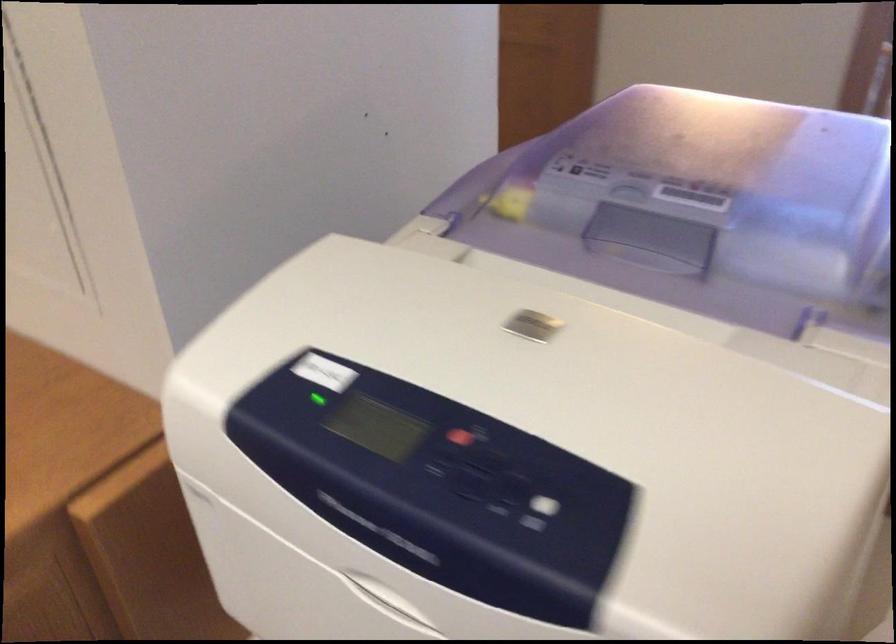
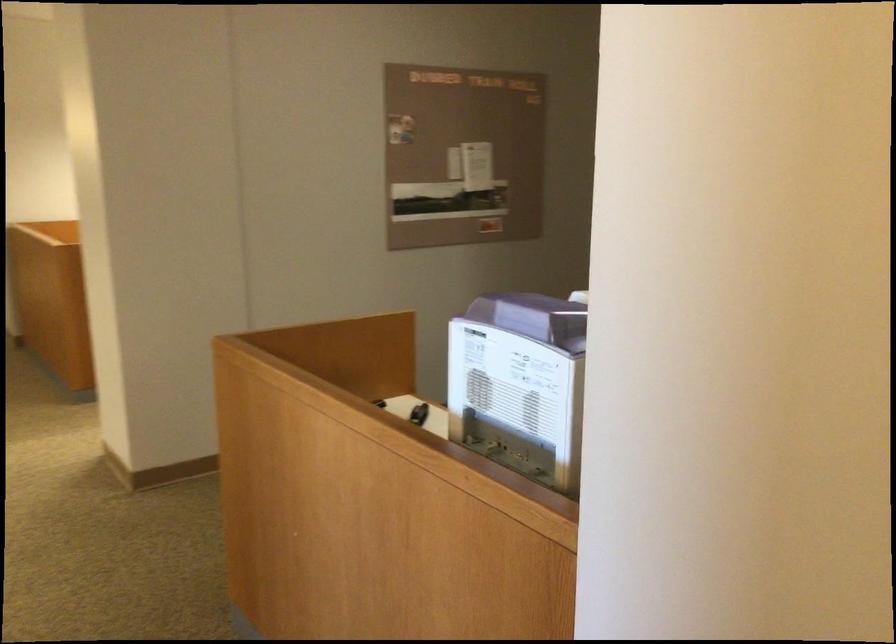
Question: I am providing you with two images of the same scene from different viewpoints. Which of the following objects are not visible in image2?

Choices:
 (A) small black object
 (B) recessed printer handle
 (C) purple machine lid
 (D) paper document

Answer: (B)